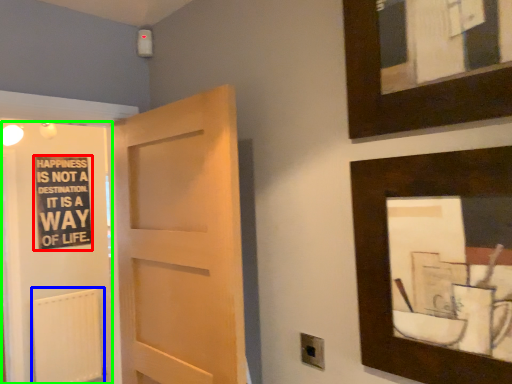
Question: Which object is positioned closest to bulletin board (highlighted by a red box)? Select from radiator (highlighted by a blue box) and elevator (highlighted by a green box).

Choices:
 (A) radiator
 (B) elevator

Answer: (B)